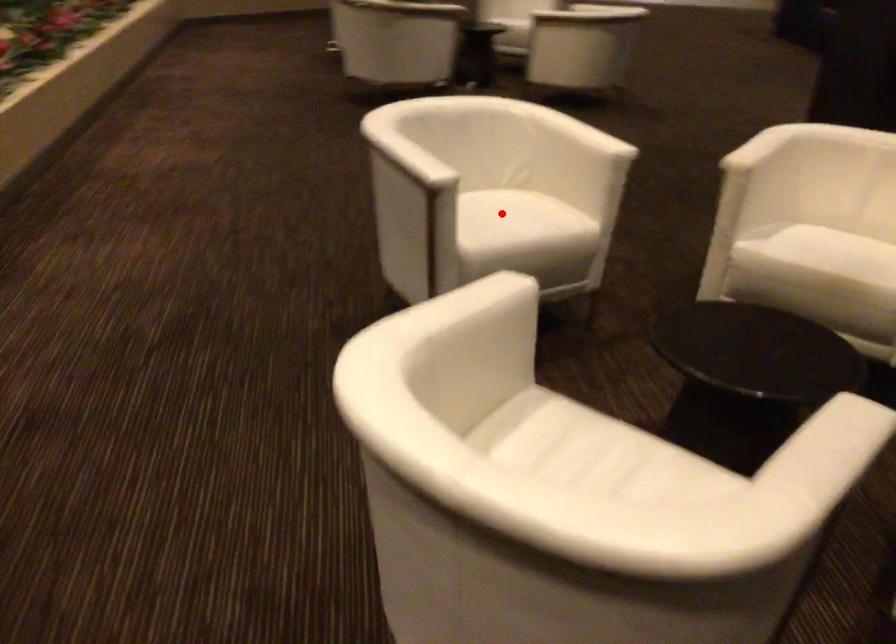
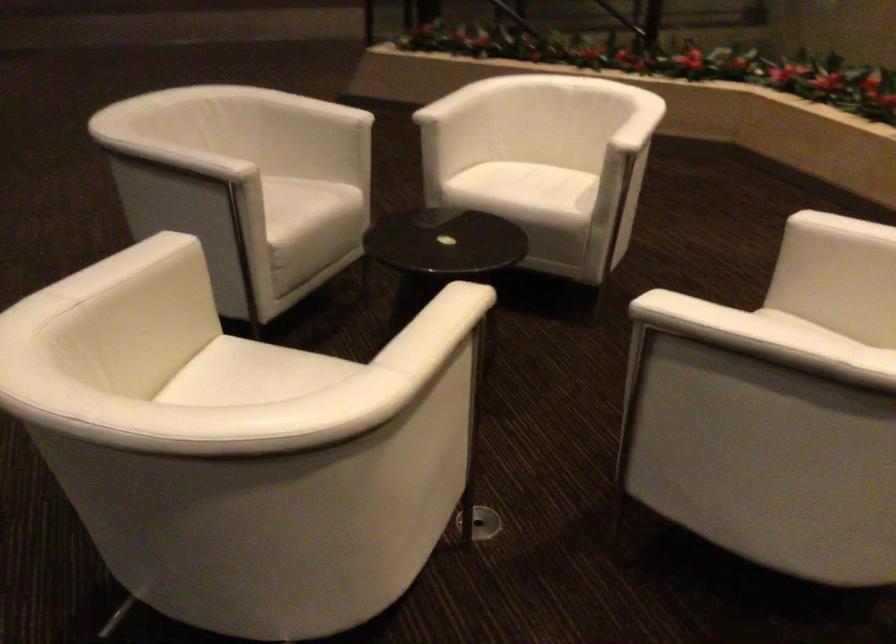
Question: I am providing you with two images of the same scene from different viewpoints. A red point is marked on the first image. At the location where the point appears in image 1, is it still visible in image 2?

Choices:
 (A) Yes
 (B) No

Answer: (B)